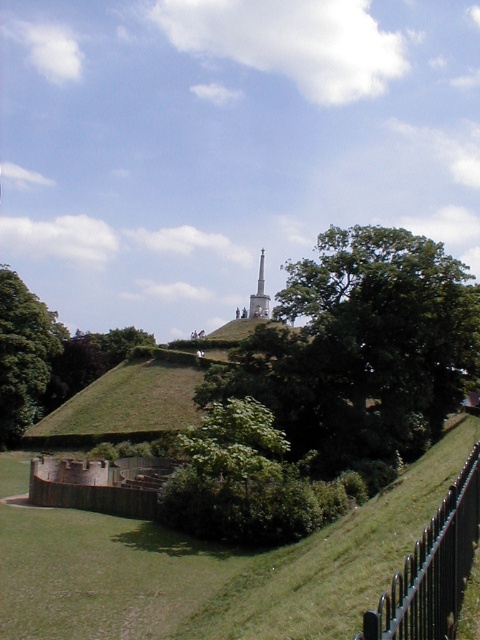
Question: Is black metal fence at lower right to the left of green leafy tree at left from the viewer's perspective?

Choices:
 (A) yes
 (B) no

Answer: (B)

Question: Which object is closer to the camera taking this photo?

Choices:
 (A) green leafy tree at upper center
 (B) white marble tower at center
 (C) black metal fence at lower right

Answer: (C)

Question: Among these points, which one is farthest from the camera?

Choices:
 (A) (455, 580)
 (B) (263, 266)
 (C) (7, 289)

Answer: (B)

Question: Can you confirm if green leafy tree at left is smaller than white marble tower at center?

Choices:
 (A) no
 (B) yes

Answer: (A)

Question: Is green leafy tree at upper center above white marble tower at center?

Choices:
 (A) no
 (B) yes

Answer: (A)

Question: Which object appears closest to the camera in this image?

Choices:
 (A) green leafy tree at upper center
 (B) black metal fence at lower right
 (C) green leafy tree at left

Answer: (B)